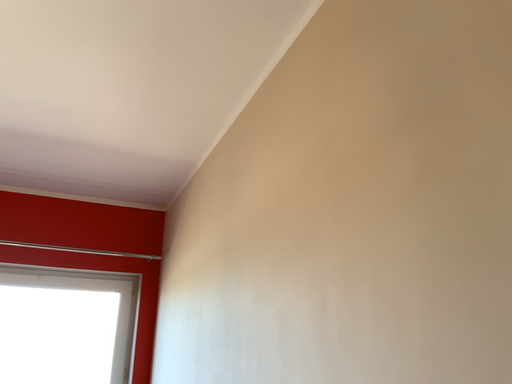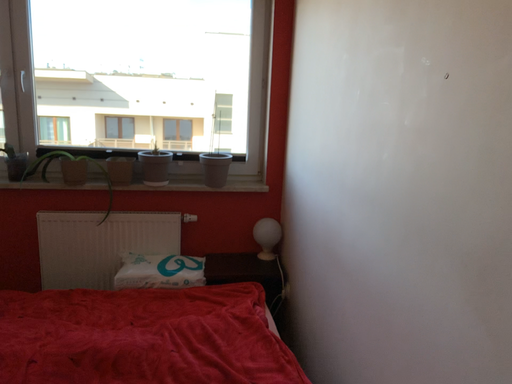
Question: How did the camera likely rotate when shooting the video?

Choices:
 (A) rotated upward
 (B) rotated downward

Answer: (B)